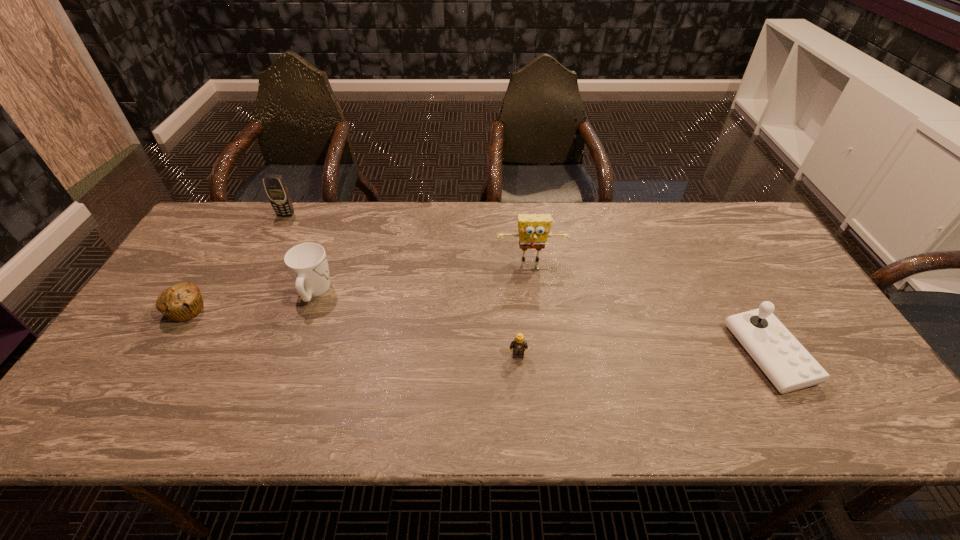
The height and width of the screenshot is (540, 960). What are the coordinates of `vacant space at the far edge of the desktop` in the screenshot? It's located at (439, 247).

Find the location of a particular element. vacant space at the near edge of the desktop is located at coordinates (288, 407).

Image resolution: width=960 pixels, height=540 pixels. In order to click on free space at the left edge in this screenshot , I will do `click(136, 370)`.

The height and width of the screenshot is (540, 960). I want to click on vacant space at the far left corner of the desktop, so [x=256, y=214].

In order to click on vacant area at the near left corner of the desktop in this screenshot , I will do `click(81, 408)`.

Locate an element on the screen. This screenshot has width=960, height=540. free space at the far right corner of the desktop is located at coordinates (722, 218).

Where is `unoccupied position between the fourth object from right to left and the rightmost object`? This screenshot has width=960, height=540. unoccupied position between the fourth object from right to left and the rightmost object is located at coordinates (541, 323).

Where is `free space between the third object from left to right and the muffin`? Image resolution: width=960 pixels, height=540 pixels. free space between the third object from left to right and the muffin is located at coordinates (251, 301).

Find the location of a particular element. This screenshot has width=960, height=540. vacant point located between the mug and the muffin is located at coordinates 251,301.

Identify the location of vacant area that lies between the muffin and the rightmost object. The width and height of the screenshot is (960, 540). (478, 332).